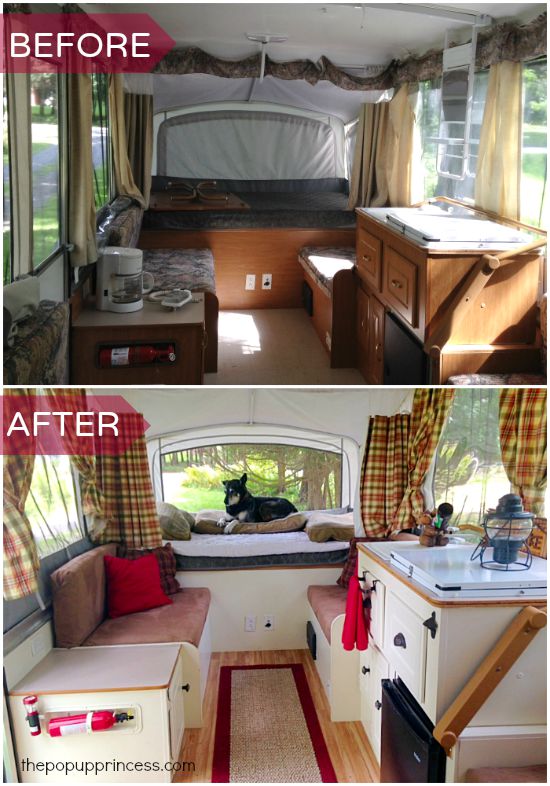
The height and width of the screenshot is (786, 550). In order to click on floor in this screenshot , I will do `click(353, 746)`.